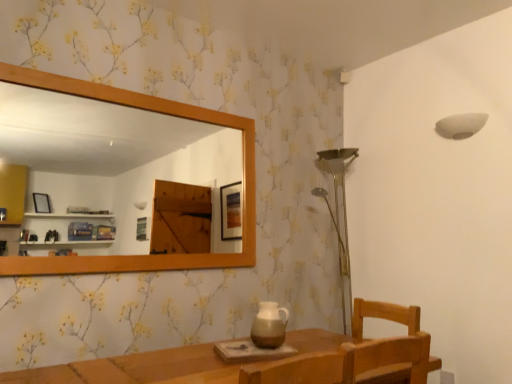
Question: Is wooden mirror at upper left touching brown ceramic pitcher at center?

Choices:
 (A) yes
 (B) no

Answer: (B)

Question: Is wooden mirror at upper left turned away from brown ceramic pitcher at center?

Choices:
 (A) no
 (B) yes

Answer: (A)

Question: Is wooden mirror at upper left at the left side of brown ceramic pitcher at center?

Choices:
 (A) no
 (B) yes

Answer: (B)

Question: Does wooden mirror at upper left have a greater height compared to brown ceramic pitcher at center?

Choices:
 (A) no
 (B) yes

Answer: (B)

Question: From a real-world perspective, is wooden mirror at upper left below brown ceramic pitcher at center?

Choices:
 (A) no
 (B) yes

Answer: (A)

Question: Can you confirm if wooden mirror at upper left is thinner than brown ceramic pitcher at center?

Choices:
 (A) no
 (B) yes

Answer: (B)

Question: Does white matte lampshade at upper right lie behind wooden mirror at upper left?

Choices:
 (A) no
 (B) yes

Answer: (B)

Question: Is white matte lampshade at upper right at the left side of wooden mirror at upper left?

Choices:
 (A) no
 (B) yes

Answer: (A)

Question: Is white matte lampshade at upper right bigger than wooden mirror at upper left?

Choices:
 (A) yes
 (B) no

Answer: (B)

Question: Is white matte lampshade at upper right looking in the opposite direction of wooden mirror at upper left?

Choices:
 (A) yes
 (B) no

Answer: (B)

Question: Could you tell me if white matte lampshade at upper right is facing wooden mirror at upper left?

Choices:
 (A) no
 (B) yes

Answer: (B)

Question: From the image's perspective, is white matte lampshade at upper right located beneath wooden mirror at upper left?

Choices:
 (A) yes
 (B) no

Answer: (B)

Question: Is the position of wooden mirror at upper left more distant than that of white matte lampshade at upper right?

Choices:
 (A) no
 (B) yes

Answer: (A)